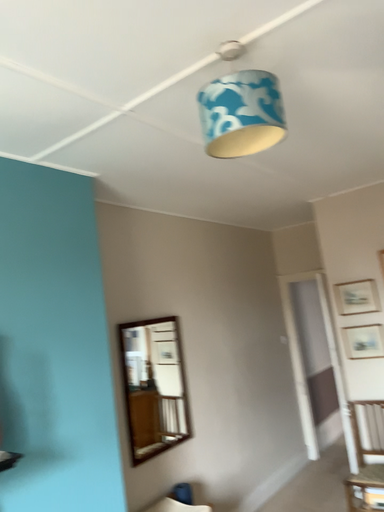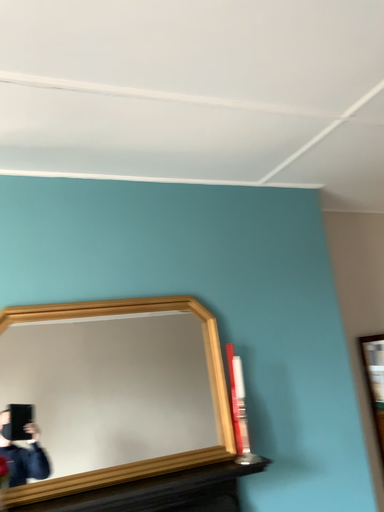
Question: Which way did the camera rotate in the video?

Choices:
 (A) rotated left
 (B) rotated right

Answer: (A)